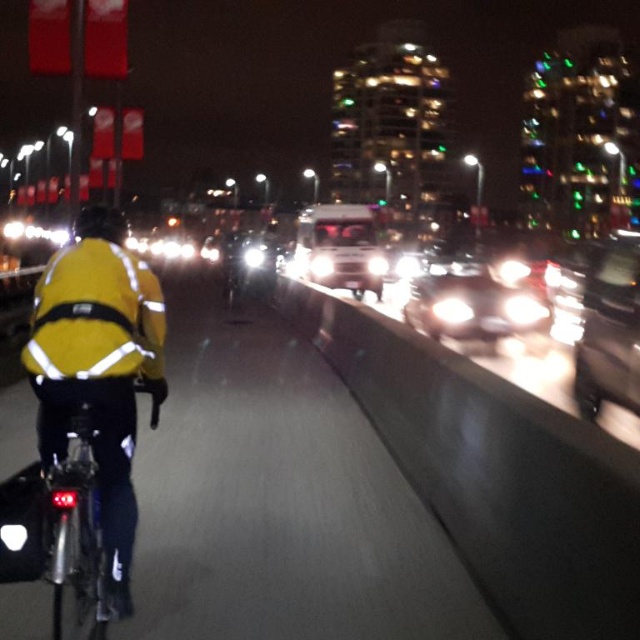
Based on the scene description, where is the shiny silver sedan at right located in the image?

The shiny silver sedan at right is located at point [609,328] in the image.

You are a cyclist wearing a high visibility yellow jacket with reflective stripes, riding a bicycle with a rear light. You are currently at point (632, 323) and want to reach point (74, 236). Can you safely move forward to reach your destination?

Point (632, 323) is behind point (74, 236), so yes, you can safely move forward to reach point (74, 236) from point (632, 323) as you are behind it.